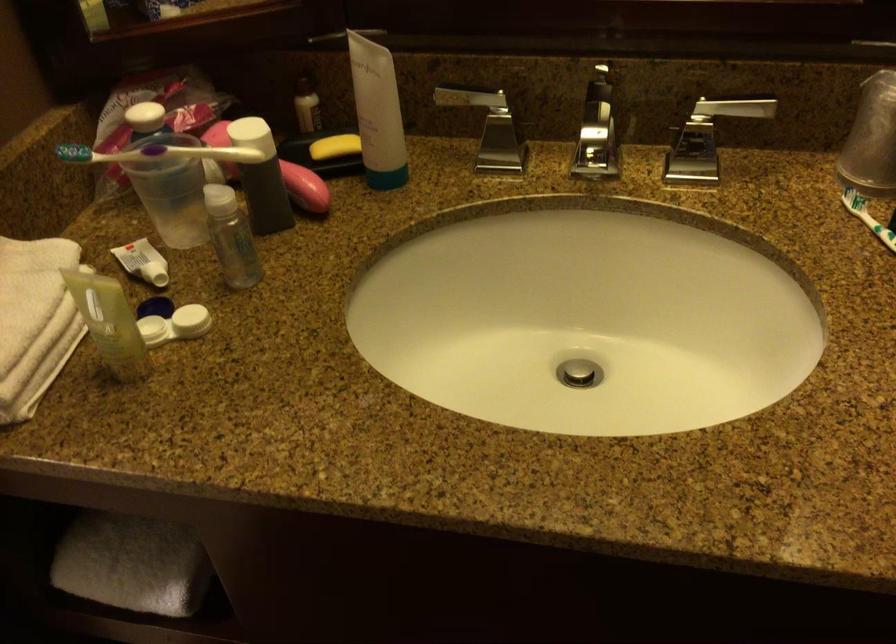
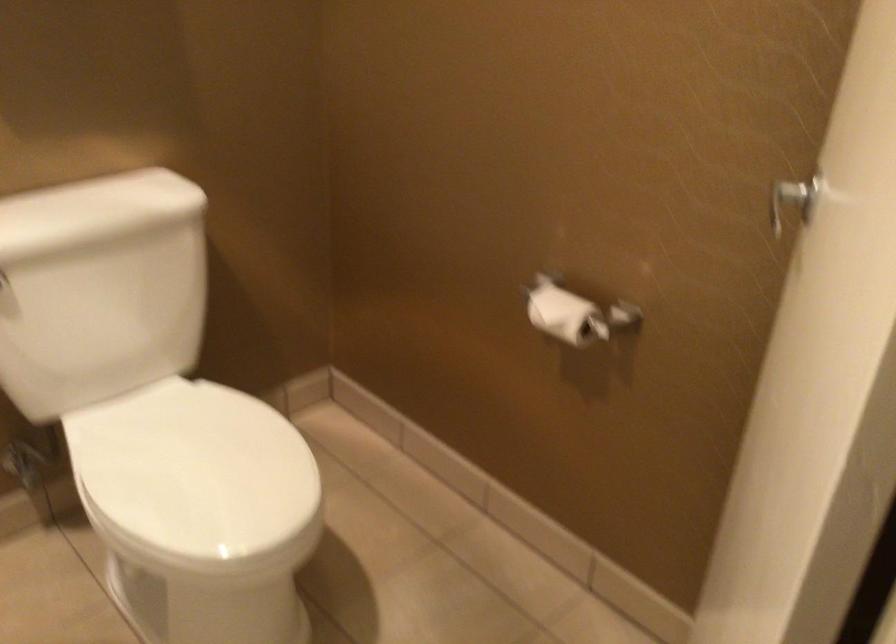
Question: Based on the continuous images, in which direction is the camera rotating? Reply with the corresponding letter.

Choices:
 (A) Left
 (B) Right
 (C) Up
 (D) Down

Answer: (A)